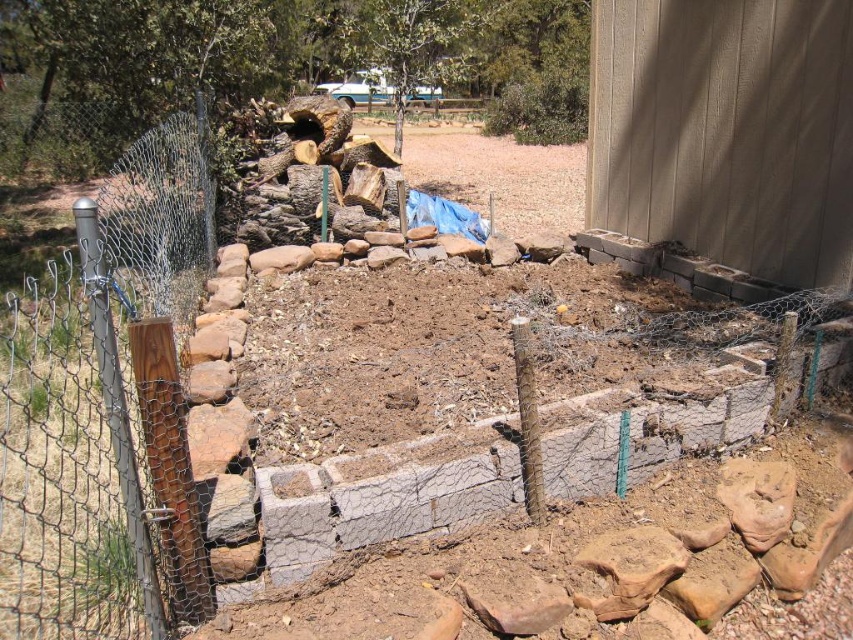
From the picture: Does brown wooden post at left appear under brown soil at center?

Yes, brown wooden post at left is below brown soil at center.

Which is behind, point (161, 150) or point (379, 132)?

Point (379, 132)

Image resolution: width=853 pixels, height=640 pixels. I want to click on brown wooden post at left, so click(x=107, y=410).